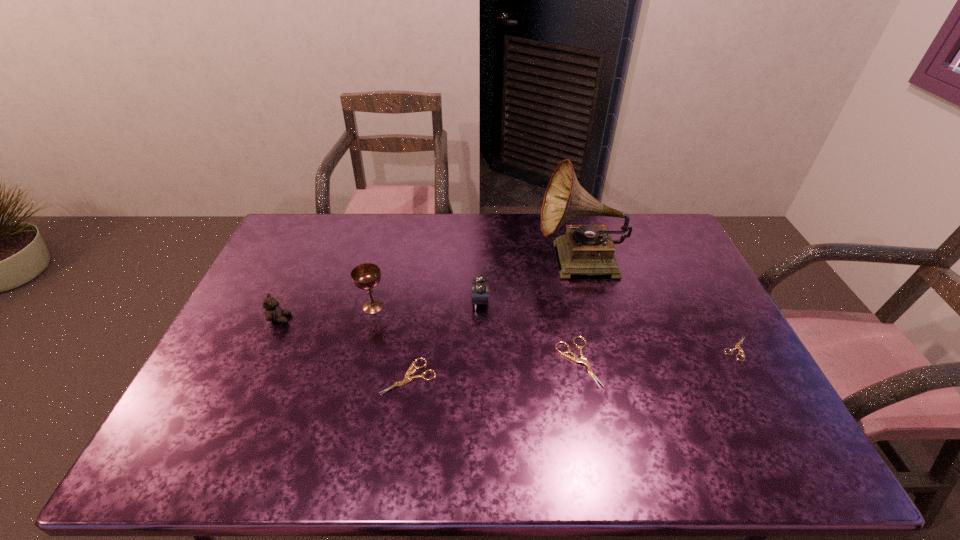
Select which object appears as the fifth closest to the second shortest shears. Please provide its 2D coordinates. Your answer should be formatted as a tuple, i.e. [(x, y)], where the tuple contains the x and y coordinates of a point satisfying the conditions above.

[(585, 249)]

Find the location of a particular element. the second closest shears to the shortest object is located at coordinates (407, 379).

Where is `the second closest shears relative to the leftmost object`? the second closest shears relative to the leftmost object is located at coordinates point(575,358).

Find the location of a particular element. free region that satisfies the following two spatial constraints: 1. on the back side of the shortest shears; 2. on the front side of the fourth object from left to right is located at coordinates 711,302.

The image size is (960, 540). I want to click on vacant space that satisfies the following two spatial constraints: 1. on the face of the second shears from left to right; 2. on the right side of the leftmost object, so click(260, 362).